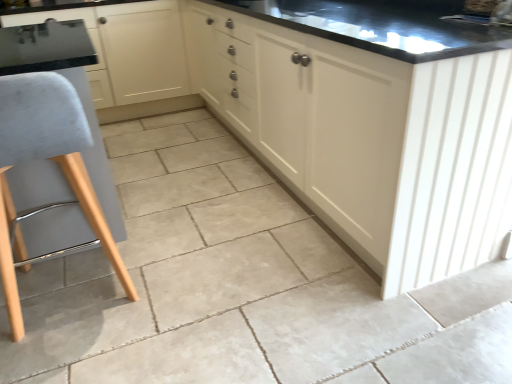
Question: Is point (493, 21) positioned closer to the camera than point (214, 49)?

Choices:
 (A) farther
 (B) closer

Answer: (B)

Question: From the image's perspective, is matte black sink at upper center located above or below matte cream cabinet at center, which ranks as the 2th cabinetry in left-to-right order?

Choices:
 (A) below
 (B) above

Answer: (A)

Question: Which of these objects is positioned closest to the matte white cabinet at center, which ranks as the 2th cabinetry in right-to-left order?

Choices:
 (A) matte cream cabinet at center, arranged as the 1th cabinetry when viewed from the right
 (B) light gray fabric stool at left
 (C) matte black sink at upper center

Answer: (A)

Question: Which object is the closest to the matte cream cabinet at center, arranged as the 1th cabinetry when viewed from the right?

Choices:
 (A) light gray fabric stool at left
 (B) matte white cabinet at center, the 1th cabinetry viewed from the left
 (C) matte black sink at upper center

Answer: (C)